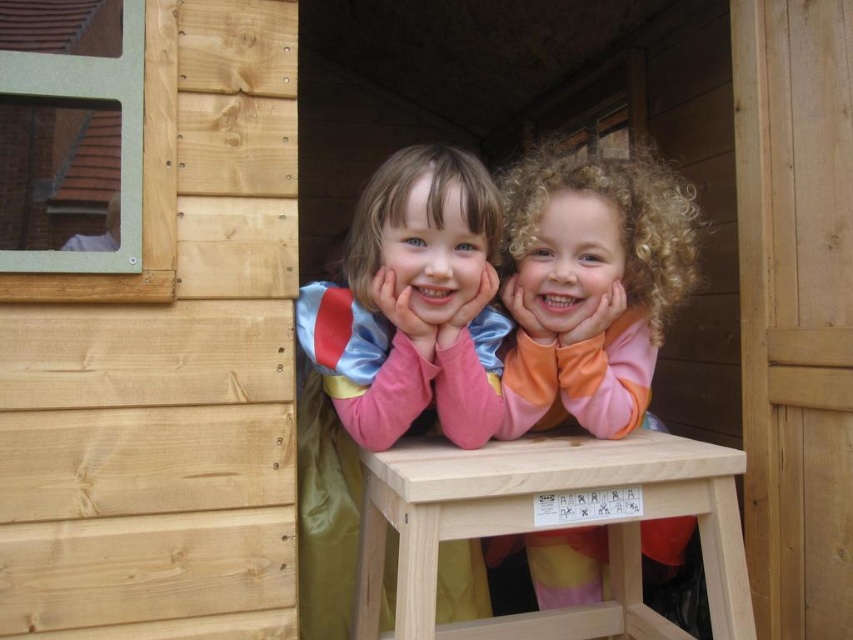
Question: Can you confirm if matte pink sweater at center is smaller than curly-haired child at center?

Choices:
 (A) no
 (B) yes

Answer: (A)

Question: Does matte pink sweater at center appear under curly-haired child at center?

Choices:
 (A) no
 (B) yes

Answer: (B)

Question: Which of the following is the farthest from the observer?

Choices:
 (A) (714, 627)
 (B) (579, 406)
 (C) (424, 369)

Answer: (B)

Question: Which object is positioned farthest from the light wood stool at center?

Choices:
 (A) curly-haired child at center
 (B) matte pink sweater at center

Answer: (A)

Question: Which point is closer to the camera taking this photo?

Choices:
 (A) (300, 572)
 (B) (587, 410)
 (C) (708, 540)

Answer: (C)

Question: Is curly-haired child at center below light wood stool at center?

Choices:
 (A) no
 (B) yes

Answer: (A)